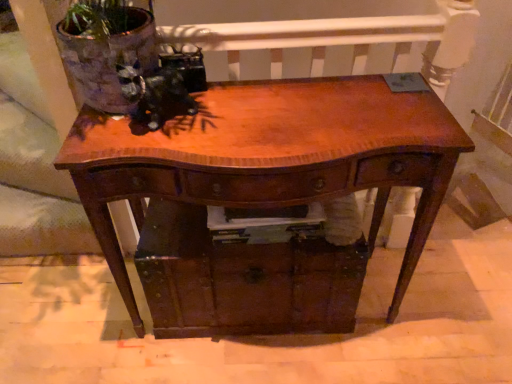
Where is `free location to the right of shiny brown wood table at center`? free location to the right of shiny brown wood table at center is located at coordinates [x=443, y=313].